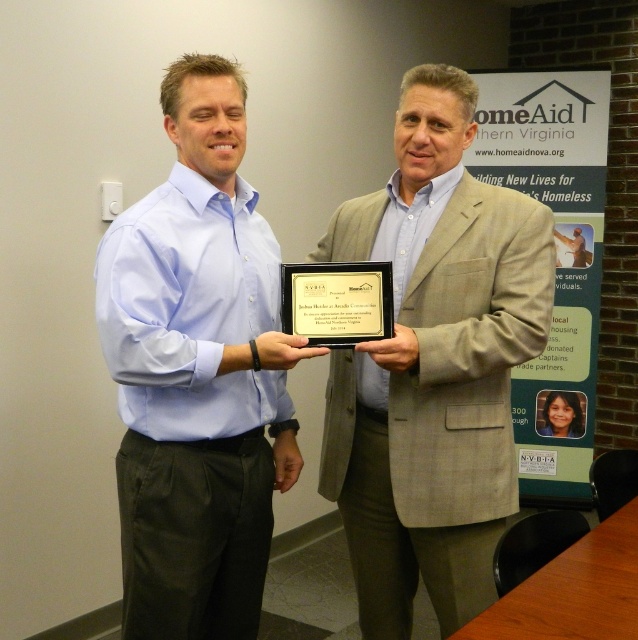
You are standing 3 feet away from the light brown textured blazer at center. If you want to reach it, will you be able to touch it without moving your feet?

The light brown textured blazer at center is 5.07 feet away from the viewer. Since you are standing 3 feet away from it, you can extend your arm to touch it without moving your feet.

You are a photographer taking a picture of the light brown textured blazer at center and the black plastic plaque at center. Which object should you focus on first if you want to ensure the taller object is in sharp focus?

The light brown textured blazer at center is taller than the black plastic plaque at center, so you should focus on the light brown textured blazer at center first to ensure it is in sharp focus.

You are a photographer adjusting your camera to focus on the light blue shirt at center and the black plastic plaque at center. Which object should you adjust the focus to first if you want to capture the larger object in sharp detail?

The light blue shirt at center is bigger than the black plastic plaque at center, so you should focus on the light blue shirt at center first to ensure it is in sharp detail.